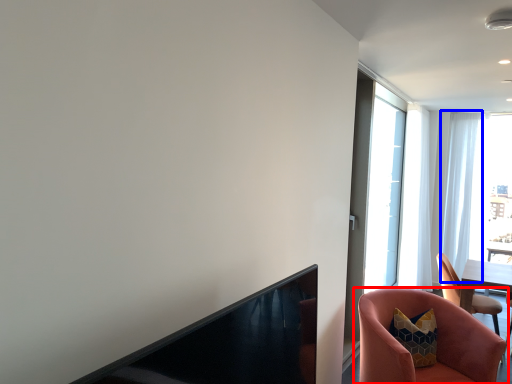
Question: Which object is closer to the camera taking this photo, chair (highlighted by a red box) or curtain (highlighted by a blue box)?

Choices:
 (A) chair
 (B) curtain

Answer: (A)